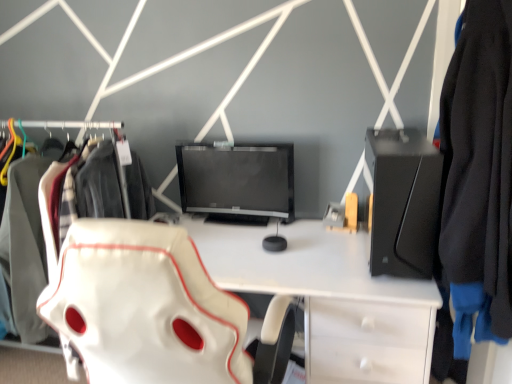
Question: From the image's perspective, is white leather swivel chair at center above matte black monitor at center?

Choices:
 (A) yes
 (B) no

Answer: (B)

Question: Is white leather swivel chair at center positioned with its back to matte black monitor at center?

Choices:
 (A) yes
 (B) no

Answer: (B)

Question: From a real-world perspective, does white leather swivel chair at center sit lower than matte black monitor at center?

Choices:
 (A) no
 (B) yes

Answer: (B)

Question: Can you confirm if white leather swivel chair at center is thinner than matte black monitor at center?

Choices:
 (A) no
 (B) yes

Answer: (A)

Question: From a real-world perspective, is white leather swivel chair at center on matte black monitor at center?

Choices:
 (A) yes
 (B) no

Answer: (B)

Question: Does white leather swivel chair at center have a lesser height compared to matte black monitor at center?

Choices:
 (A) no
 (B) yes

Answer: (A)

Question: From the image's perspective, does black fabric jacket at right appear higher than white leather swivel chair at center?

Choices:
 (A) yes
 (B) no

Answer: (A)

Question: Is black fabric jacket at right facing away from white leather swivel chair at center?

Choices:
 (A) yes
 (B) no

Answer: (B)

Question: Is the position of black fabric jacket at right less distant than that of white leather swivel chair at center?

Choices:
 (A) no
 (B) yes

Answer: (A)

Question: Considering the relative sizes of black fabric jacket at right and white leather swivel chair at center in the image provided, is black fabric jacket at right wider than white leather swivel chair at center?

Choices:
 (A) yes
 (B) no

Answer: (B)

Question: Can you confirm if black fabric jacket at right is taller than white leather swivel chair at center?

Choices:
 (A) no
 (B) yes

Answer: (A)

Question: Is black fabric jacket at right aimed at white leather swivel chair at center?

Choices:
 (A) no
 (B) yes

Answer: (B)

Question: Does black fabric jacket at right have a lesser height compared to black matte desktop at right?

Choices:
 (A) yes
 (B) no

Answer: (B)